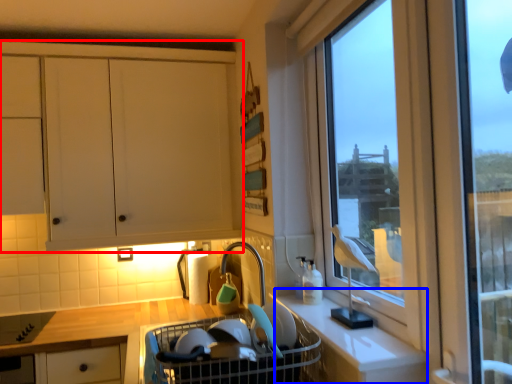
Question: Among these objects, which one is nearest to the camera, cabinetry (highlighted by a red box) or counter (highlighted by a blue box)?

Choices:
 (A) cabinetry
 (B) counter

Answer: (B)